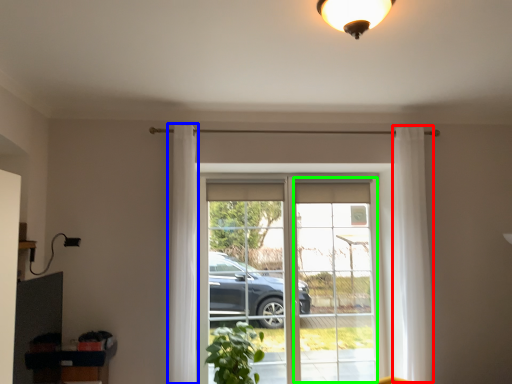
Question: Which object is positioned farthest from curtain (highlighted by a red box)? Select from curtain (highlighted by a blue box) and window frame (highlighted by a green box).

Choices:
 (A) curtain
 (B) window frame

Answer: (A)